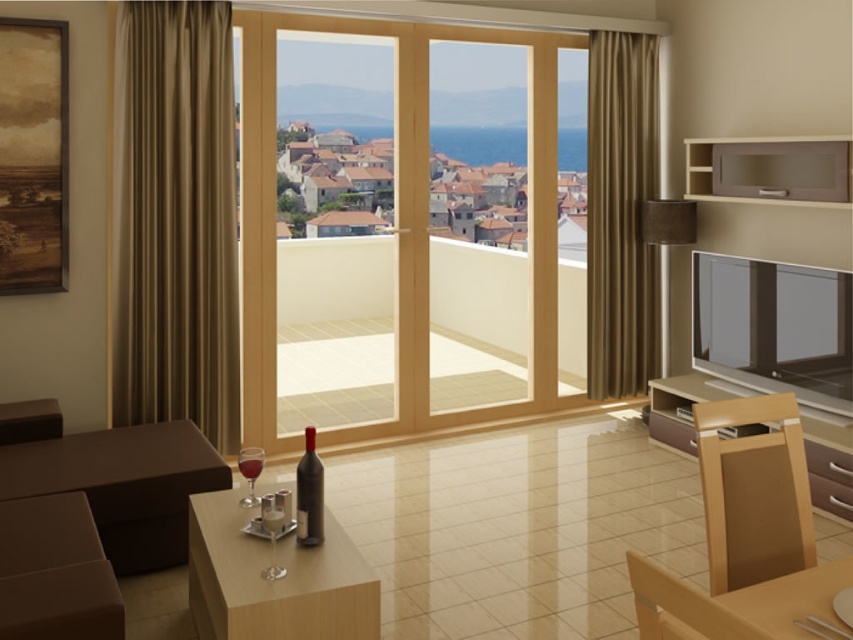
Question: Does brown fabric curtain at left come behind matte glass microwave at upper right?

Choices:
 (A) no
 (B) yes

Answer: (A)

Question: Which of the following is the farthest from the observer?

Choices:
 (A) brown velvet curtain at right
 (B) clear glass wine glass at lower center
 (C) translucent glass wine at lower center

Answer: (A)

Question: Can you confirm if light brown wooden table at lower right is thinner than translucent glass wine at lower center?

Choices:
 (A) no
 (B) yes

Answer: (A)

Question: From the image, what is the correct spatial relationship of clear glass wine glass at lower center in relation to translucent glass wine at lower center?

Choices:
 (A) left
 (B) right

Answer: (B)

Question: Which point is closer to the camera taking this photo?

Choices:
 (A) (352, 216)
 (B) (709, 563)
 (C) (305, 509)

Answer: (B)

Question: Which point is closer to the camera?

Choices:
 (A) brown fabric curtain at left
 (B) matte glass microwave at upper right
 (C) transparent glass wine glass at lower left
 (D) clear glass door at center

Answer: (C)